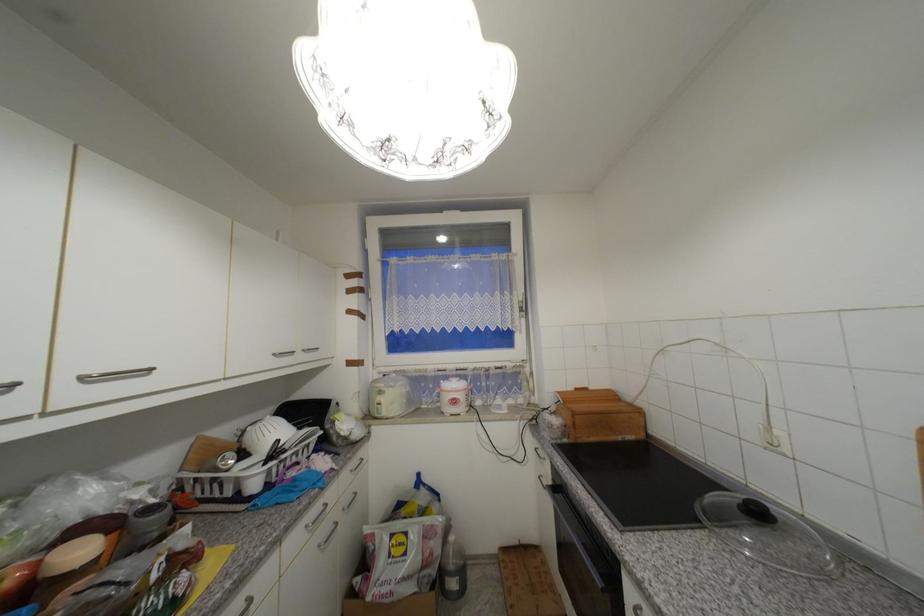
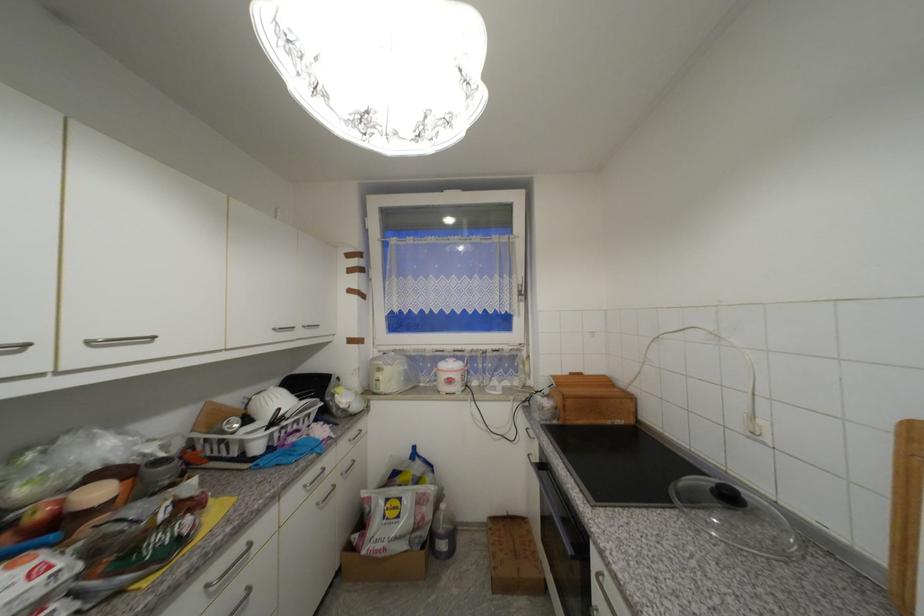
In the second image, find the point that corresponds to point 529,322 in the first image.

(528, 306)